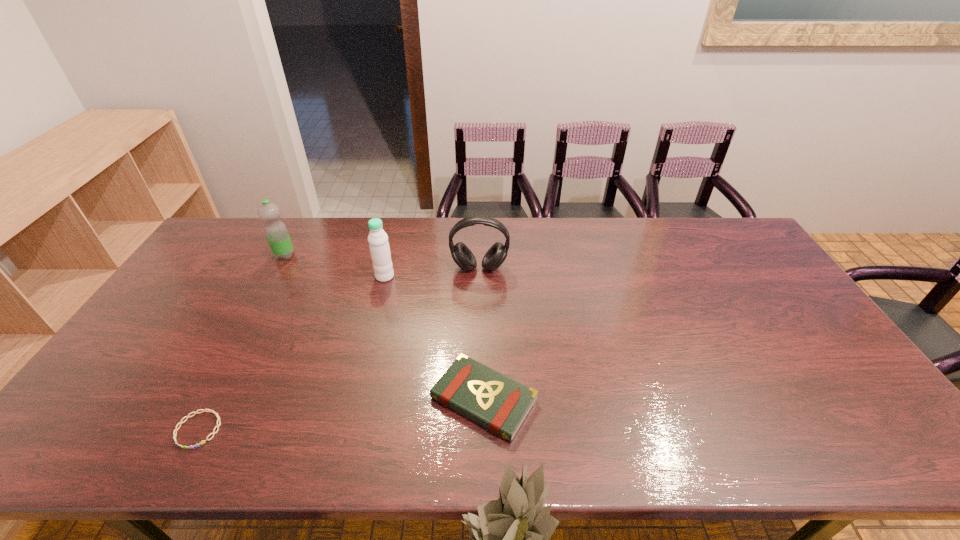
What are the coordinates of `the left water bottle` in the screenshot? It's located at (276, 232).

Locate an element on the screen. the nearer water bottle is located at coordinates (378, 242).

Where is `the third object from left to right`? The height and width of the screenshot is (540, 960). the third object from left to right is located at coordinates (378, 242).

Where is `headset`? The image size is (960, 540). headset is located at coordinates (495, 256).

Locate an element on the screen. book is located at coordinates (493, 400).

Find the location of a particular element. This screenshot has height=540, width=960. the shortest object is located at coordinates (216, 414).

Find the location of a particular element. This screenshot has width=960, height=540. free space located 0.160m on the front of the farther water bottle is located at coordinates (264, 295).

Identify the location of vacant region located on the front of the right water bottle. The height and width of the screenshot is (540, 960). (357, 388).

Locate an element on the screen. The height and width of the screenshot is (540, 960). vacant position located 0.090m on the earcups of the headset is located at coordinates [479, 295].

You are a GUI agent. You are given a task and a screenshot of the screen. Output one action in this format:
    pyautogui.click(x=<x>, y=<y>)
    Task: Click on the free location located on the back of the book
    The image size is (960, 540).
    Given the screenshot: What is the action you would take?
    pyautogui.click(x=483, y=269)